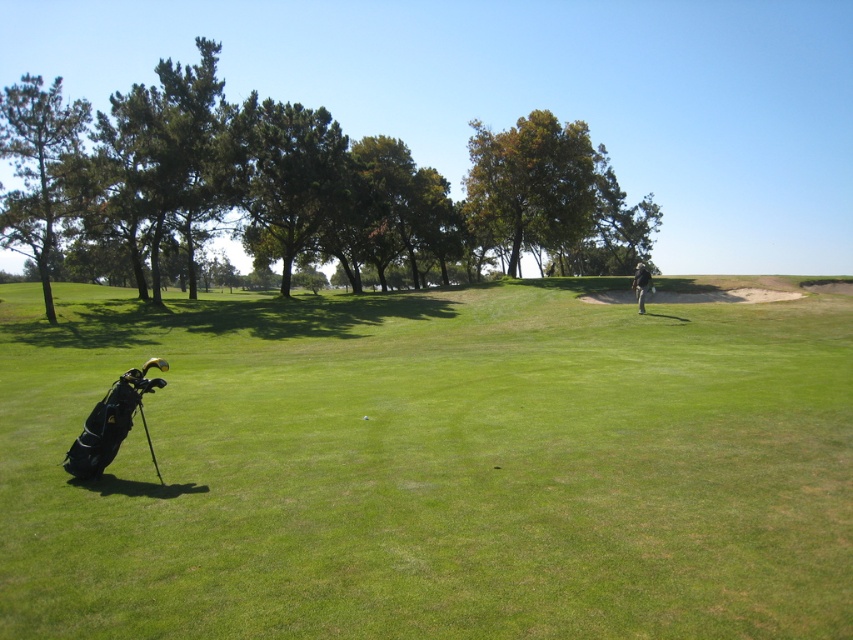
You are a golfer standing at the center of the image. You need to retrieve your golf club from the black leather golf bag at lower left. Based on your current position, in which direction should you move to reach the bag?

The black leather golf bag at lower left is located at point (430,467). Since you are at the center, you should move towards the lower left direction to reach the bag.

You are a golfer trying to hit a ball to the point marked at coordinates (45, 196). The golf course is flat and clear between you and the target. Your driver has a maximum distance of 280 meters, and your 7 iron reaches up to 160 meters. Which club should you choose to ensure you can reach the point without overshooting?

The point is 32.78 meters away. Since the 7 iron reaches up to 160 meters, it can comfortably reach the target without overshooting. The driver, with its maximum of 280 meters, would likely go too far. Choose the 7 iron.

You are a golfer standing on the course and see the green matte tree at left and the light brown leather jacket at center. Which object is higher in the scene?

The green matte tree at left is higher than the light brown leather jacket at center.